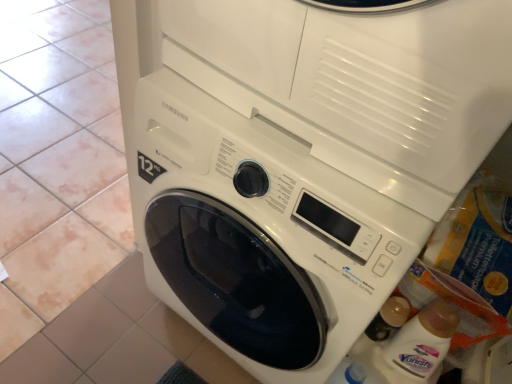
What is the approximate width of white glossy bottle at lower right?

white glossy bottle at lower right is 3.79 inches in width.

This screenshot has height=384, width=512. I want to click on white glossy bottle at lower right, so click(423, 341).

The height and width of the screenshot is (384, 512). What do you see at coordinates (423, 341) in the screenshot?
I see `white glossy bottle at lower right` at bounding box center [423, 341].

You are a GUI agent. You are given a task and a screenshot of the screen. Output one action in this format:
    pyautogui.click(x=<x>, y=<y>)
    Task: Click on the white glossy bottle at lower right
    This screenshot has height=384, width=512.
    Given the screenshot: What is the action you would take?
    pyautogui.click(x=423, y=341)